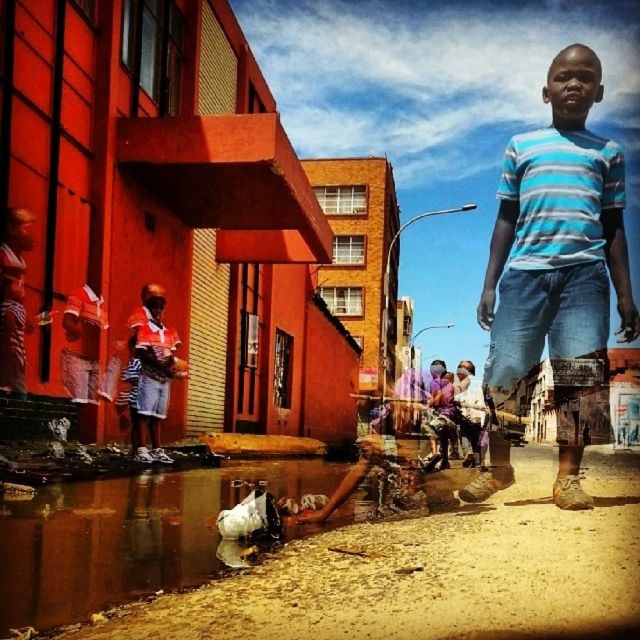
Is blue striped shirt at center below brown plastic bag at lower center?

Actually, blue striped shirt at center is above brown plastic bag at lower center.

Is blue striped shirt at center thinner than brown plastic bag at lower center?

No, blue striped shirt at center is not thinner than brown plastic bag at lower center.

Describe the element at coordinates (557, 236) in the screenshot. I see `blue striped shirt at center` at that location.

Where is `blue striped shirt at center`? blue striped shirt at center is located at coordinates (557, 236).

Which is behind, point (595, 202) or point (132, 324)?

The point (132, 324) is more distant.

You are a GUI agent. You are given a task and a screenshot of the screen. Output one action in this format:
    pyautogui.click(x=<x>, y=<y>)
    Task: Click on the blue striped shirt at center
    The width and height of the screenshot is (640, 640).
    Given the screenshot: What is the action you would take?
    pyautogui.click(x=557, y=236)

Is point (536, 188) less distant than point (182, 371)?

Yes, it is.

Image resolution: width=640 pixels, height=640 pixels. Identify the location of blue striped shirt at center. (557, 236).

Can you confirm if brown plastic bag at lower center is shorter than matte red shorts at lower left?

Correct, brown plastic bag at lower center is not as tall as matte red shorts at lower left.

Is point (88, 524) closer to camera compared to point (161, 330)?

That is True.

Which is in front, point (148, 474) or point (154, 435)?

Point (148, 474) is more forward.

Identify the location of brown plastic bag at lower center. (128, 536).